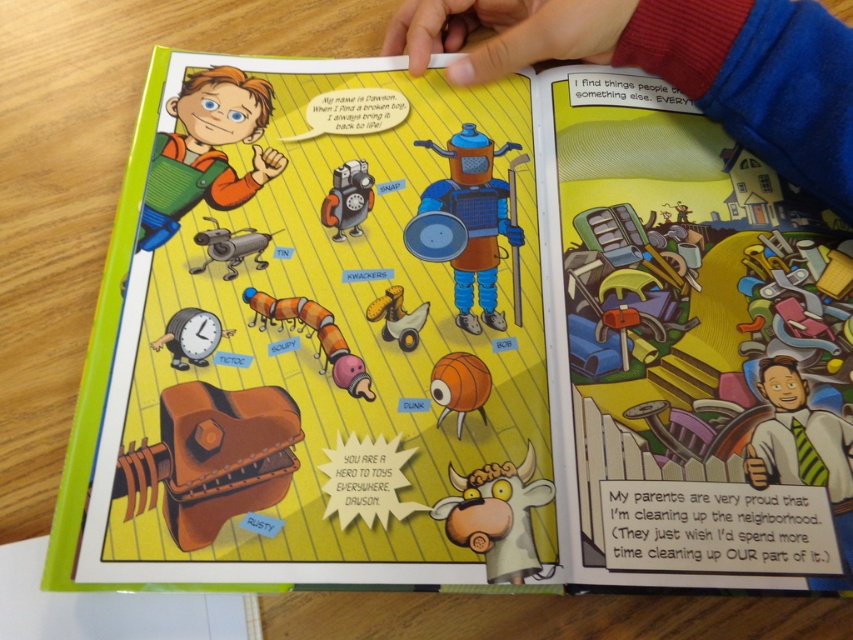
You are a character in the comic book scene. You need to locate the white striped tie at lower right and the rusty metal clock at lower left. Which object is positioned further to the east in the image?

The white striped tie at lower right is positioned further to the east than the rusty metal clock at lower left.

You are holding a comic book page and notice a point marked at coordinates (151, 168). If your hand is 1 meter away from the page, will the point be closer to your hand than 50 centimeters?

The point at (151, 168) is 53.24 centimeters from the camera. Since your hand is 1 meter away from the page, the point is actually 53.24 cm away from the camera, which is further than 50 cm. Therefore, the point is not closer to your hand than 50 centimeters.